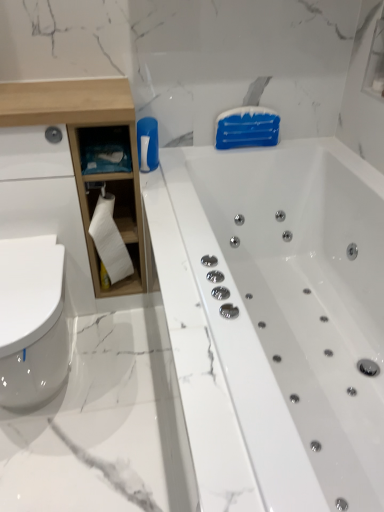
Question: Considering the relative sizes of white glossy toilet at lower left and white wood cabinet at left in the image provided, is white glossy toilet at lower left thinner than white wood cabinet at left?

Choices:
 (A) yes
 (B) no

Answer: (B)

Question: Is white glossy toilet at lower left beside white wood cabinet at left?

Choices:
 (A) no
 (B) yes

Answer: (A)

Question: Can you confirm if white glossy toilet at lower left is positioned to the right of white wood cabinet at left?

Choices:
 (A) yes
 (B) no

Answer: (B)

Question: Could you tell me if white glossy toilet at lower left is facing white wood cabinet at left?

Choices:
 (A) no
 (B) yes

Answer: (A)

Question: Can you confirm if white glossy toilet at lower left is bigger than white wood cabinet at left?

Choices:
 (A) yes
 (B) no

Answer: (B)

Question: Is white glossy toilet at lower left located outside white wood cabinet at left?

Choices:
 (A) no
 (B) yes

Answer: (B)

Question: From a real-world perspective, is white glossy toilet at lower left positioned over white glossy bathtub at center based on gravity?

Choices:
 (A) no
 (B) yes

Answer: (A)

Question: Is white glossy toilet at lower left to the right of white glossy bathtub at center from the viewer's perspective?

Choices:
 (A) yes
 (B) no

Answer: (B)

Question: Does white glossy toilet at lower left turn towards white glossy bathtub at center?

Choices:
 (A) no
 (B) yes

Answer: (A)

Question: Would you consider white glossy toilet at lower left to be distant from white glossy bathtub at center?

Choices:
 (A) yes
 (B) no

Answer: (B)

Question: Is white glossy toilet at lower left smaller than white glossy bathtub at center?

Choices:
 (A) yes
 (B) no

Answer: (A)

Question: Can you confirm if white glossy toilet at lower left is shorter than white glossy bathtub at center?

Choices:
 (A) no
 (B) yes

Answer: (B)

Question: Are white matte toilet paper at left and white glossy bathtub at center located far from each other?

Choices:
 (A) no
 (B) yes

Answer: (A)